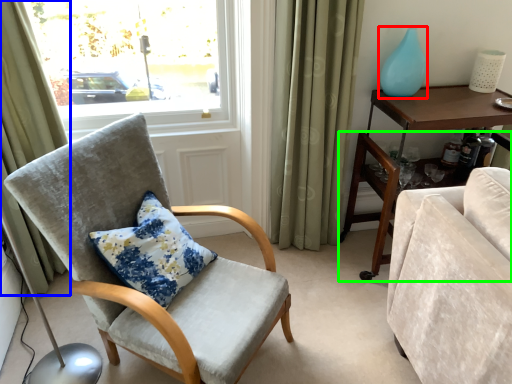
Question: Based on their relative distances, which object is nearer to glass vase (highlighted by a red box)? Choose from curtain (highlighted by a blue box) and desk (highlighted by a green box).

Choices:
 (A) curtain
 (B) desk

Answer: (B)